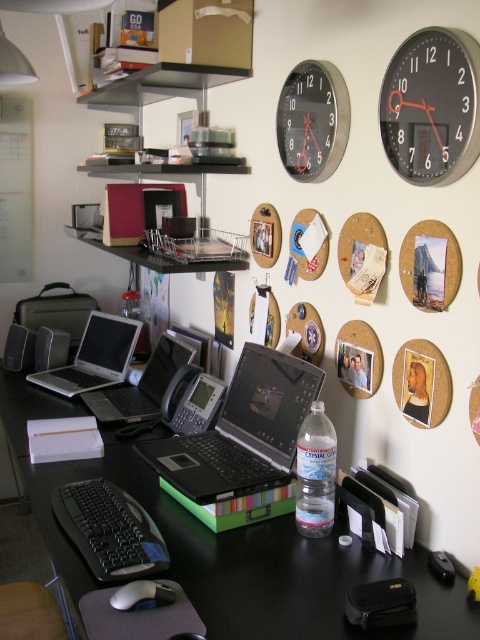
Does point (303, 99) come closer to viewer compared to point (126, 364)?

Yes, it is in front of point (126, 364).

Consider the image. Which is more to the left, black metallic clock at upper center or silver/black laptop at center?

From the viewer's perspective, silver/black laptop at center appears more on the left side.

This screenshot has width=480, height=640. I want to click on black metallic clock at upper center, so 312,120.

The image size is (480, 640). What are the coordinates of `black metallic clock at upper center` in the screenshot? It's located at (312, 120).

Identify the location of black plastic computer desk at center. (230, 550).

Which is behind, point (394, 570) or point (424, 65)?

Point (394, 570)

This screenshot has width=480, height=640. Describe the element at coordinates (230, 550) in the screenshot. I see `black plastic computer desk at center` at that location.

At what (x,y) coordinates should I click in order to perform the action: click on black plastic computer desk at center. Please return your answer as a coordinate pair (x, y). This screenshot has width=480, height=640. Looking at the image, I should click on (230, 550).

Does black plastic computer desk at center have a greater width compared to black matte laptop at center?

Correct, the width of black plastic computer desk at center exceeds that of black matte laptop at center.

Identify the location of black plastic computer desk at center. This screenshot has height=640, width=480. (230, 550).